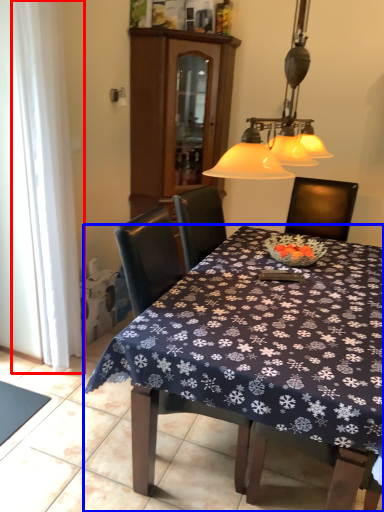
Question: Which of the following is the closest to the observer, curtain (highlighted by a red box) or kitchen & dining room table (highlighted by a blue box)?

Choices:
 (A) curtain
 (B) kitchen & dining room table

Answer: (B)